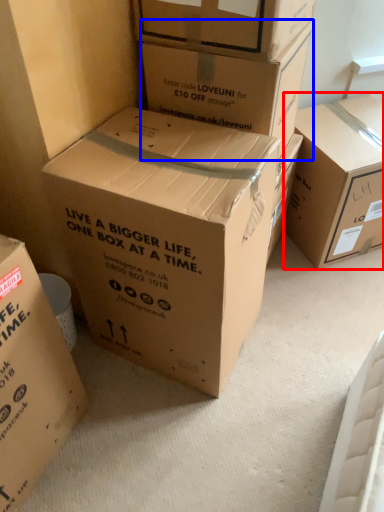
Question: Which object appears farthest to the camera in this image, box (highlighted by a red box) or box (highlighted by a blue box)?

Choices:
 (A) box
 (B) box

Answer: (A)